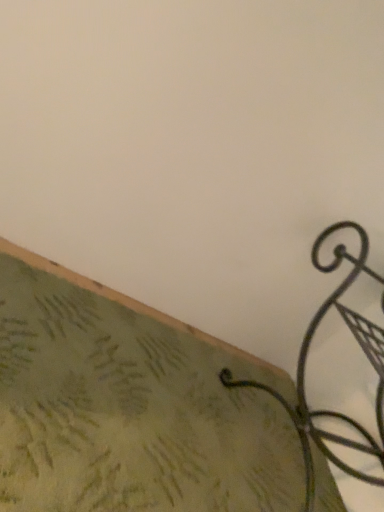
Question: From a real-world perspective, is green textured fabric at lower left physically located above or below black wrought iron hook at lower right?

Choices:
 (A) below
 (B) above

Answer: (A)

Question: Is green textured fabric at lower left in front of or behind black wrought iron hook at lower right in the image?

Choices:
 (A) front
 (B) behind

Answer: (A)

Question: Is green textured fabric at lower left taller or shorter than black wrought iron hook at lower right?

Choices:
 (A) tall
 (B) short

Answer: (B)

Question: Considering the positions of black wrought iron hook at lower right and green textured fabric at lower left in the image, is black wrought iron hook at lower right bigger or smaller than green textured fabric at lower left?

Choices:
 (A) small
 (B) big

Answer: (B)

Question: Do you think black wrought iron hook at lower right is within green textured fabric at lower left, or outside of it?

Choices:
 (A) inside
 (B) outside

Answer: (B)

Question: Would you say black wrought iron hook at lower right is to the left or to the right of green textured fabric at lower left in the picture?

Choices:
 (A) right
 (B) left

Answer: (A)

Question: In terms of width, does black wrought iron hook at lower right look wider or thinner when compared to green textured fabric at lower left?

Choices:
 (A) wide
 (B) thin

Answer: (B)